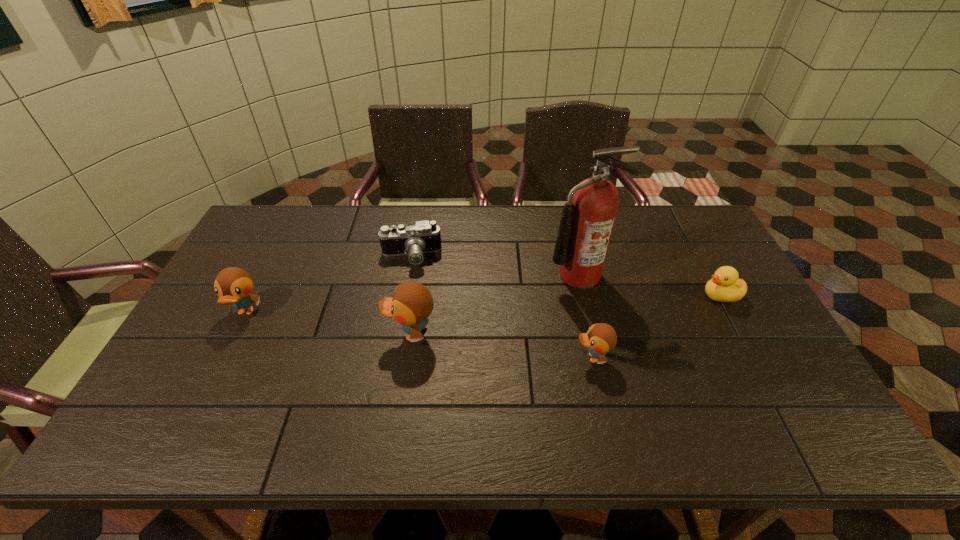
The height and width of the screenshot is (540, 960). I want to click on free space for a new duck on the right, so click(792, 383).